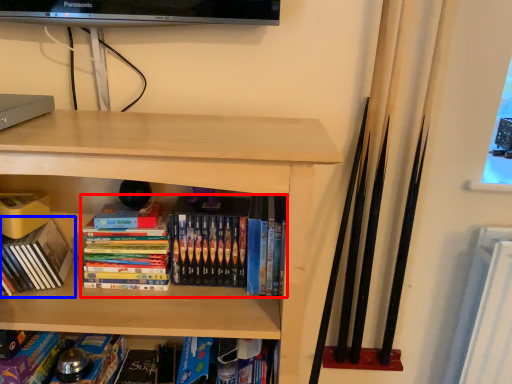
Question: Which object appears farthest to the camera in this image, book (highlighted by a red box) or book (highlighted by a blue box)?

Choices:
 (A) book
 (B) book

Answer: (A)